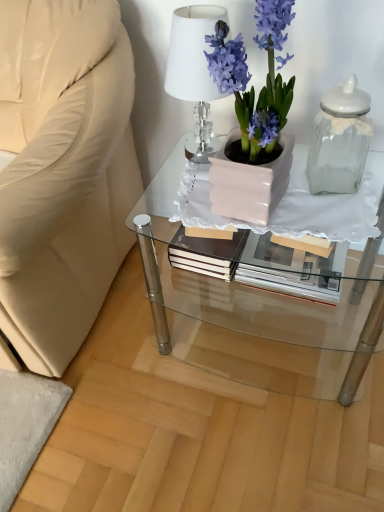
Question: Is point (322, 156) closer or farther from the camera than point (269, 201)?

Choices:
 (A) closer
 (B) farther

Answer: (B)

Question: Would you say clear glass jar at right is inside or outside matte pink pot at center?

Choices:
 (A) outside
 (B) inside

Answer: (A)

Question: Estimate the real-world distances between objects in this image. Which object is closer to the matte pink pot at center?

Choices:
 (A) white crystal lamp at upper center
 (B) clear glass jar at right
 (C) matte white glass table at center

Answer: (A)

Question: Which of these objects is positioned closest to the clear glass jar at right?

Choices:
 (A) matte white glass table at center
 (B) white crystal lamp at upper center
 (C) matte pink pot at center

Answer: (C)